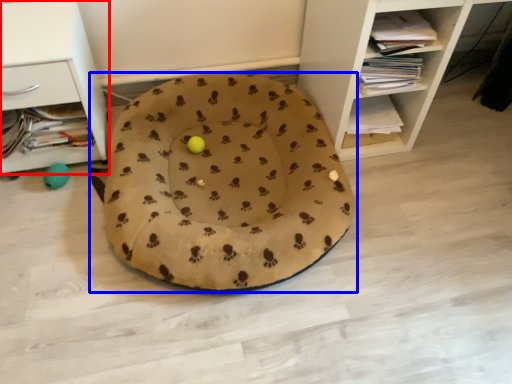
Question: Which object appears closest to the camera in this image, shelf (highlighted by a red box) or dog bed (highlighted by a blue box)?

Choices:
 (A) shelf
 (B) dog bed

Answer: (B)